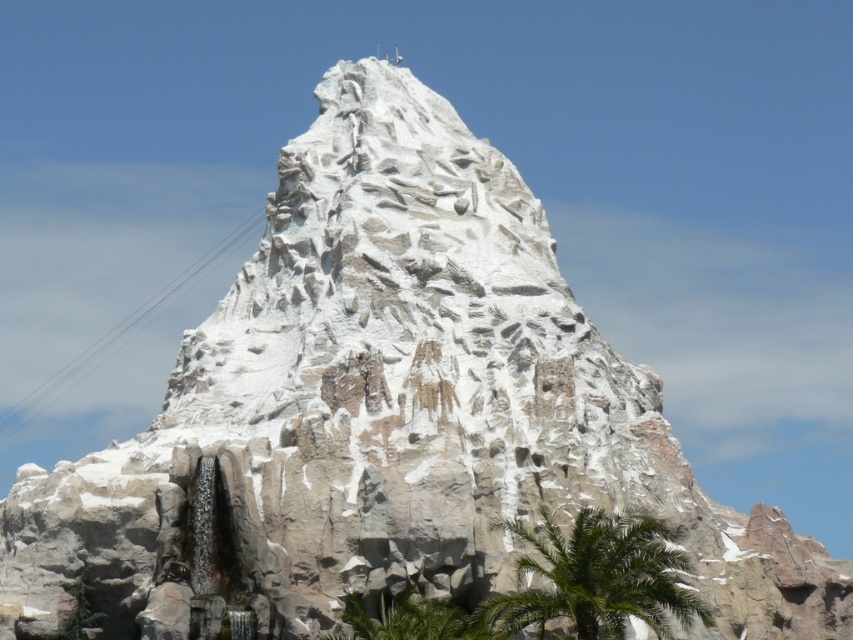
Which of these two, green leafy palm tree at lower right or green leafy palm tree at lower center, stands taller?

green leafy palm tree at lower right

Does point (560, 561) come farther from viewer compared to point (434, 600)?

No, (560, 561) is closer to viewer.

You are a GUI agent. You are given a task and a screenshot of the screen. Output one action in this format:
    pyautogui.click(x=<x>, y=<y>)
    Task: Click on the green leafy palm tree at lower right
    The width and height of the screenshot is (853, 640).
    Given the screenshot: What is the action you would take?
    pyautogui.click(x=596, y=577)

Identify the location of green leafy palm tree at lower right. The width and height of the screenshot is (853, 640). (596, 577).